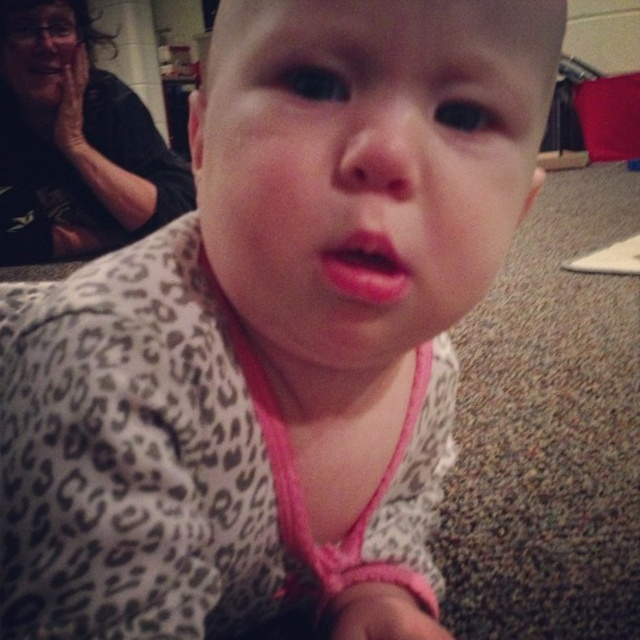
You are a photographer adjusting your camera settings to capture the baby in the scene. You notice the matte black shirt at upper left and the pink matte lips at center. Which object should you focus on if you want to capture the larger one in your shot?

The matte black shirt at upper left is larger in size than the pink matte lips at center, so you should focus on the matte black shirt at upper left to capture the larger one.

You are a photographer adjusting the camera focus. The scene has a matte black shirt at upper left and pink matte lips at center. Which object is closer to the camera lens?

The matte black shirt at upper left is positioned over the pink matte lips at center, so it is closer to the camera lens.